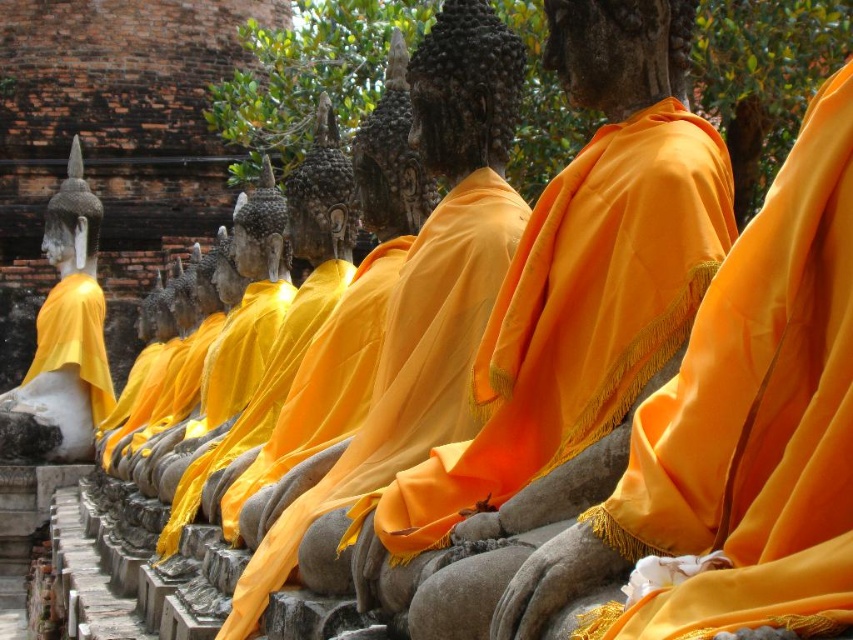
Who is more distant from viewer, (482, 189) or (84, 292)?

The point (84, 292) is behind.

Can you confirm if matte yellow cloth at center is bigger than matte gold statue at left?

No.

Who is more distant from viewer, (450, 413) or (103, 308)?

The point (103, 308) is behind.

Locate an element on the screen. The width and height of the screenshot is (853, 640). matte yellow cloth at center is located at coordinates (424, 284).

This screenshot has width=853, height=640. Describe the element at coordinates (584, 272) in the screenshot. I see `orange silk cloth at center` at that location.

Which of these two, orange silk cloth at center or matte gold statue at left, stands taller?

matte gold statue at left

Is point (543, 337) positioned after point (71, 324)?

No, (543, 337) is in front of (71, 324).

In order to click on orange silk cloth at center in this screenshot , I will do `click(584, 272)`.

What are the coordinates of `orange silk cloth at center` in the screenshot? It's located at (584, 272).